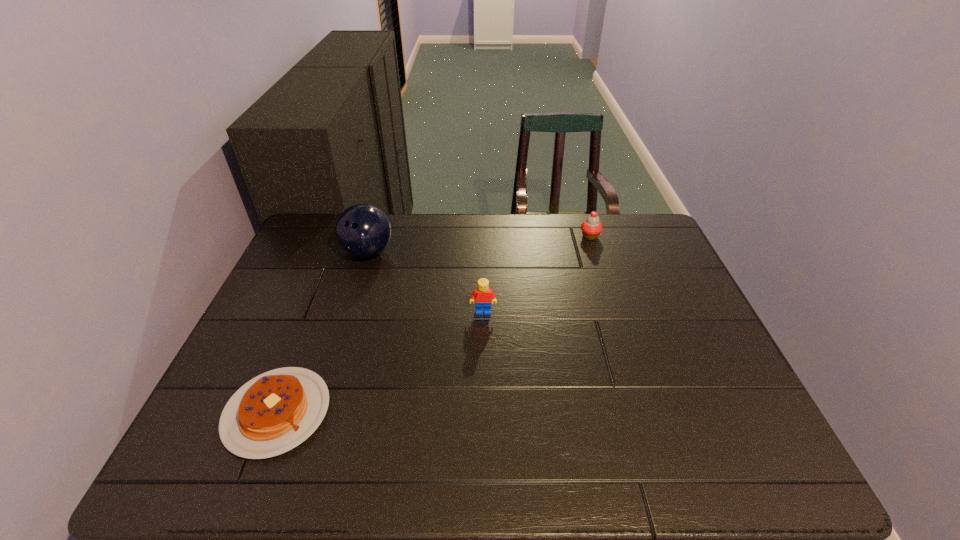
What are the coordinates of `the tallest object` in the screenshot? It's located at click(362, 230).

The height and width of the screenshot is (540, 960). I want to click on the third shortest object, so point(482,295).

At what (x,y) coordinates should I click in order to perform the action: click on the second nearest object. Please return your answer as a coordinate pair (x, y). This screenshot has width=960, height=540. Looking at the image, I should click on (482, 295).

Where is `the second shortest object`? the second shortest object is located at coordinates (591, 228).

The height and width of the screenshot is (540, 960). Identify the location of the rightmost object. (591, 228).

Locate an element on the screen. The height and width of the screenshot is (540, 960). the shortest object is located at coordinates (274, 412).

Image resolution: width=960 pixels, height=540 pixels. Identify the location of the nearest object. (274, 412).

Locate an element on the screen. This screenshot has width=960, height=540. free space located 0.380m on the surface of the bowling ball near the finger holes is located at coordinates (331, 372).

The width and height of the screenshot is (960, 540). Find the location of `vacant space located 0.180m on the face of the third shortest object`. vacant space located 0.180m on the face of the third shortest object is located at coordinates (484, 370).

At what (x,y) coordinates should I click in order to perform the action: click on free space located 0.290m on the front of the third tallest object. Please return your answer as a coordinate pair (x, y). This screenshot has width=960, height=540. Looking at the image, I should click on (612, 305).